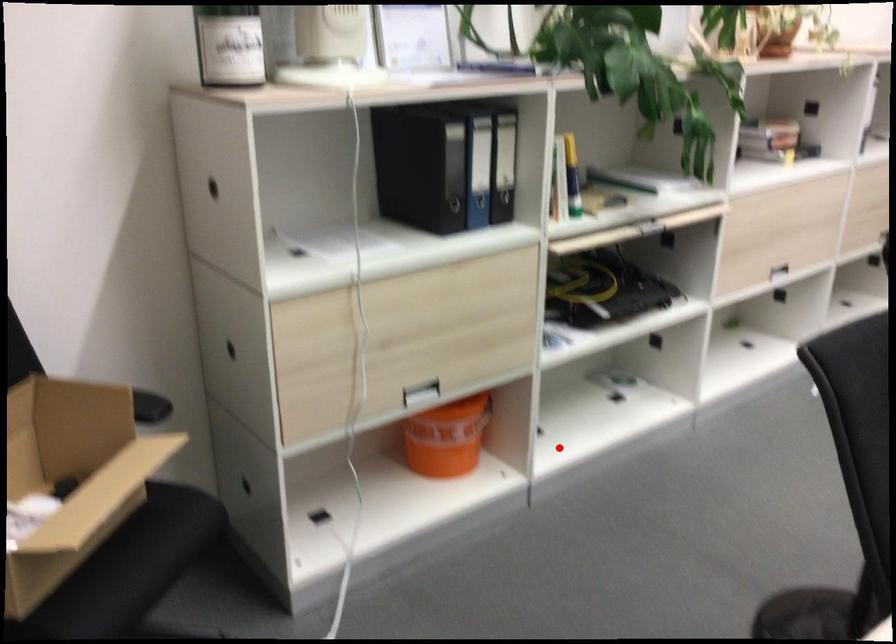
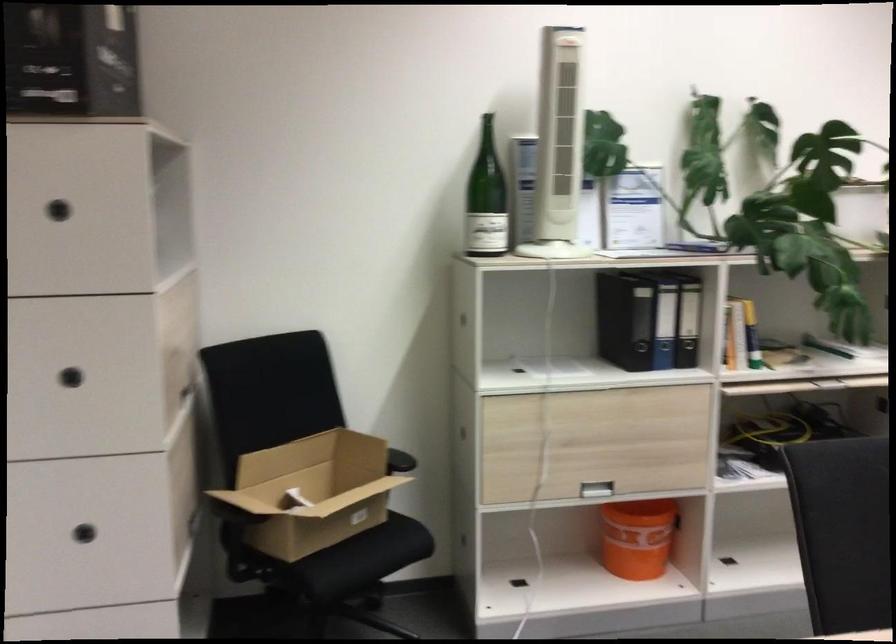
Question: I am providing you with two images of the same scene from different viewpoints. A red point is shown in image1. For the corresponding object point in image2, is it positioned nearer or farther from the camera?

Choices:
 (A) Nearer
 (B) Farther

Answer: (B)